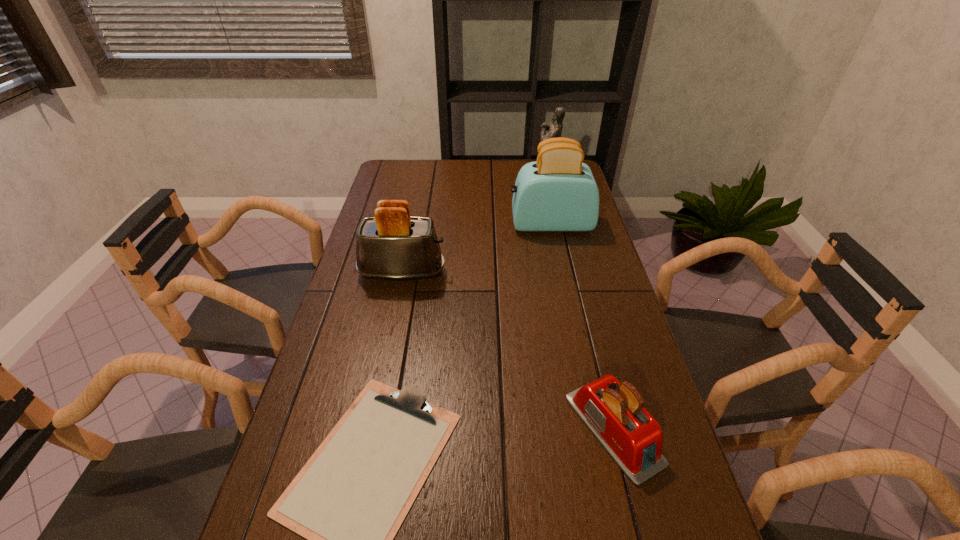
Locate an element on the screen. Image resolution: width=960 pixels, height=540 pixels. vacant space at the left edge of the desktop is located at coordinates (337, 350).

Locate an element on the screen. vacant space at the right edge of the desktop is located at coordinates (625, 356).

The width and height of the screenshot is (960, 540). In the image, there is a desktop. What are the coordinates of `vacant space at the far left corner` in the screenshot? It's located at (383, 180).

Where is `empty location between the shortest toaster and the fourth nearest object`? empty location between the shortest toaster and the fourth nearest object is located at coordinates (582, 327).

Identify the location of vacant space that's between the third tallest object and the figurine. Image resolution: width=960 pixels, height=540 pixels. (475, 226).

At what (x,y) coordinates should I click in order to perform the action: click on vacant area that lies between the nearest toaster and the figurine. Please return your answer as a coordinate pair (x, y). The height and width of the screenshot is (540, 960). Looking at the image, I should click on (581, 305).

You are a GUI agent. You are given a task and a screenshot of the screen. Output one action in this format:
    pyautogui.click(x=<x>, y=<y>)
    Task: Click on the free point between the farthest toaster and the nearest toaster
    The width and height of the screenshot is (960, 540).
    Given the screenshot: What is the action you would take?
    pyautogui.click(x=582, y=327)

This screenshot has height=540, width=960. I want to click on free spot between the farthest toaster and the third tallest object, so click(476, 248).

Find the location of a particular element. This screenshot has width=960, height=540. vacant space in between the tallest toaster and the second nearest toaster is located at coordinates (476, 248).

Identify which object is the fourth nearest to the farthest object. Please provide its 2D coordinates. Your answer should be formatted as a tuple, i.e. [(x, y)], where the tuple contains the x and y coordinates of a point satisfying the conditions above.

[(349, 500)]